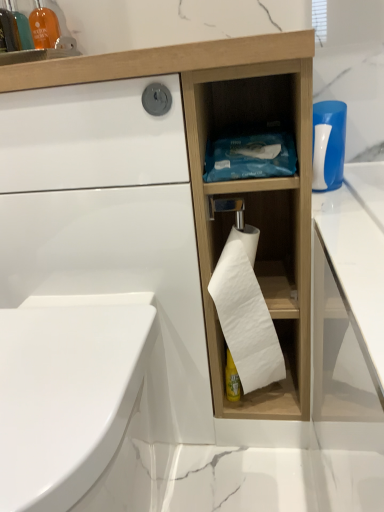
Identify the location of free spot above white glossy bidet at lower left (from a real-world perspective). The image size is (384, 512). (57, 354).